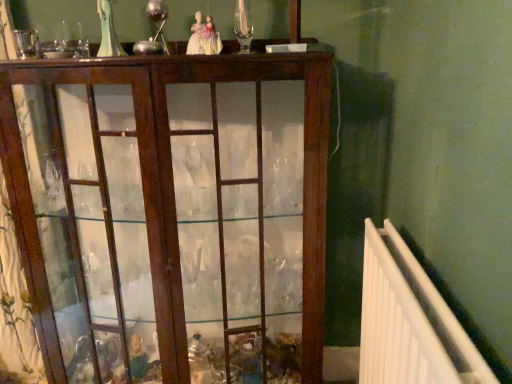
Question: Considering the relative positions of mahogany glass cabinet at center and white plastic radiator at right in the image provided, is mahogany glass cabinet at center to the left or to the right of white plastic radiator at right?

Choices:
 (A) left
 (B) right

Answer: (A)

Question: Would you say mahogany glass cabinet at center is inside or outside white plastic radiator at right?

Choices:
 (A) inside
 (B) outside

Answer: (B)

Question: In terms of height, does mahogany glass cabinet at center look taller or shorter compared to white plastic radiator at right?

Choices:
 (A) short
 (B) tall

Answer: (B)

Question: Is white plastic radiator at right wider or thinner than mahogany glass cabinet at center?

Choices:
 (A) wide
 (B) thin

Answer: (B)

Question: From a real-world perspective, is white plastic radiator at right above or below mahogany glass cabinet at center?

Choices:
 (A) above
 (B) below

Answer: (B)

Question: Is white plastic radiator at right situated inside mahogany glass cabinet at center or outside?

Choices:
 (A) inside
 (B) outside

Answer: (B)

Question: Is white plastic radiator at right in front of or behind mahogany glass cabinet at center in the image?

Choices:
 (A) front
 (B) behind

Answer: (A)